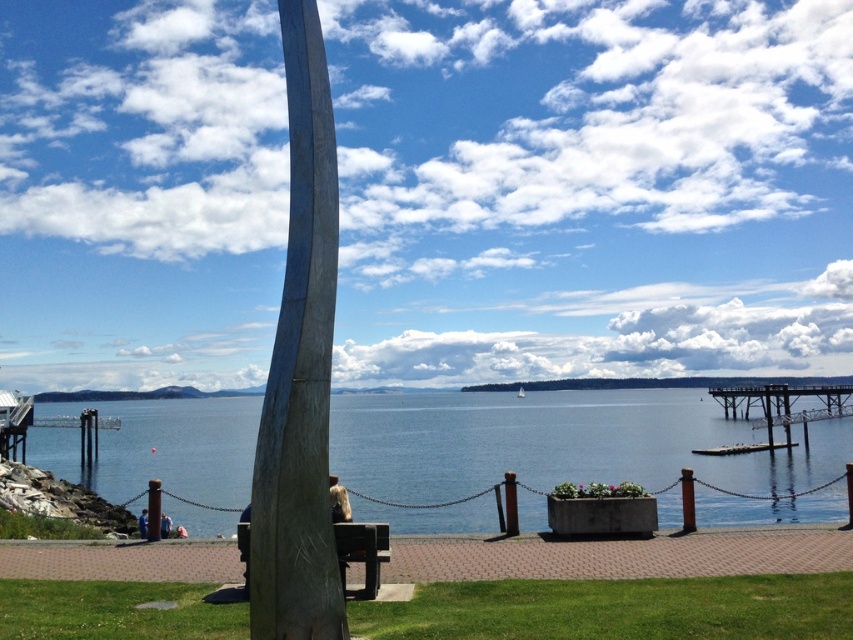
Looking at this image, does blue water at center have a greater width compared to wooden park bench at center?

Indeed, blue water at center has a greater width compared to wooden park bench at center.

Does blue water at center have a lesser height compared to wooden park bench at center?

Incorrect, blue water at center's height does not fall short of wooden park bench at center's.

The image size is (853, 640). What are the coordinates of `blue water at center` in the screenshot? It's located at (560, 442).

The height and width of the screenshot is (640, 853). I want to click on blue water at center, so click(560, 442).

Is smooth wood sculpture at center wider than blonde hair at lower center?

Yes, smooth wood sculpture at center is wider than blonde hair at lower center.

Is smooth wood sculpture at center shorter than blonde hair at lower center?

No.

I want to click on smooth wood sculpture at center, so click(x=299, y=371).

Between wooden park bench at center and blonde hair at lower center, which one appears on the left side from the viewer's perspective?

From the viewer's perspective, blonde hair at lower center appears more on the left side.

Who is more distant from viewer, (343, 557) or (163, 528)?

Point (163, 528)

Does point (349, 556) lie behind point (167, 534)?

No, (349, 556) is in front of (167, 534).

This screenshot has width=853, height=640. I want to click on wooden park bench at center, so click(363, 552).